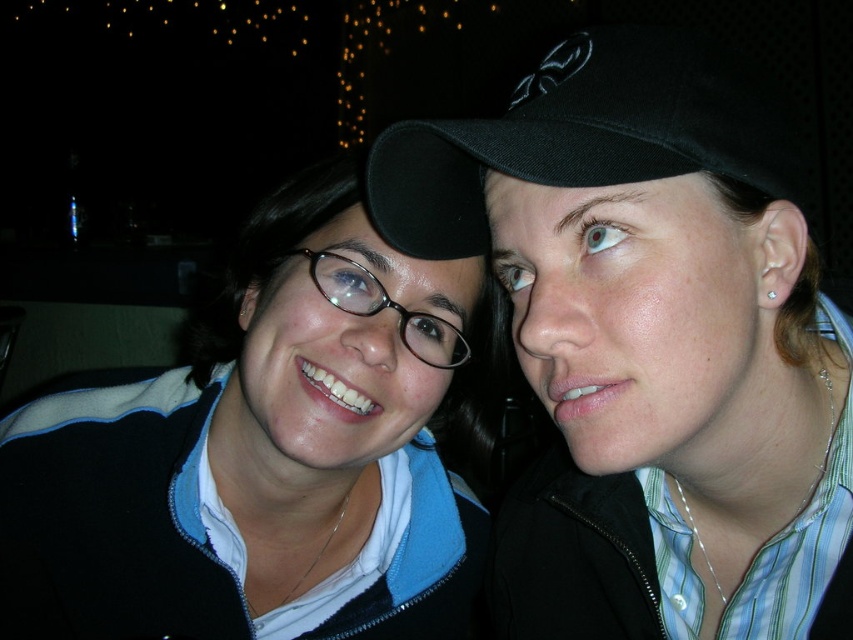
You are taking a photo with a camera that has a minimum focus distance of 16 inches. There is a point at coordinates point (677, 168) in the frame. Can the camera focus on this point?

The distance of point (677, 168) from the camera is 15.98 inches, which is slightly less than the minimum focus distance of 16 inches. Therefore, the camera may not be able to focus on this point as it is just under the required distance.

You are a photographer trying to adjust the lighting for a portrait. You notice two black matte caps in the frame. Which one is positioned lower between the black matte cap at upper right and the black matte baseball cap at upper center?

The black matte cap at upper right is positioned lower than the black matte baseball cap at upper center.

You are taking a photo of two people standing in front of you. You notice the black matte baseball cap at upper center and the matte black glasses at center. Which object is nearer to you?

The black matte baseball cap at upper center is closer to the viewer than the matte black glasses at center, so the black matte baseball cap at upper center is nearer to you.